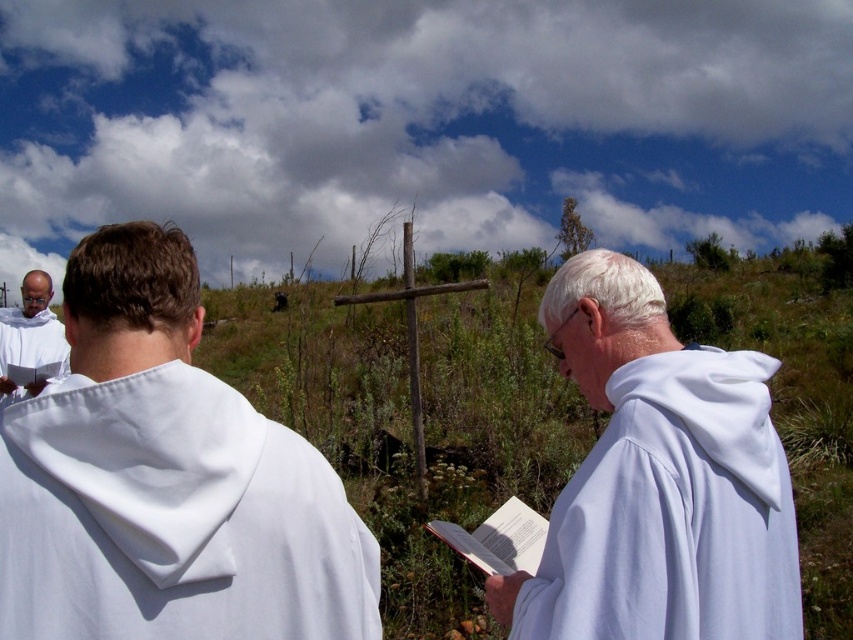
Question: Estimate the real-world distances between objects in this image. Which object is closer to the white cloth book at center?

Choices:
 (A) white clothed figure at left
 (B) white cloth at left

Answer: (B)

Question: Which object is closer to the camera taking this photo?

Choices:
 (A) white cloth at left
 (B) white cloth book at center

Answer: (A)

Question: Does white cloth at left appear under white clothed figure at left?

Choices:
 (A) yes
 (B) no

Answer: (A)

Question: Can you confirm if white cloth at left is positioned below white cloth book at center?

Choices:
 (A) no
 (B) yes

Answer: (A)

Question: Which object is closer to the camera taking this photo?

Choices:
 (A) white cloth at left
 (B) white cloth book at center
 (C) white clothed figure at left

Answer: (A)

Question: Where is white cloth book at center located in relation to white clothed figure at left in the image?

Choices:
 (A) above
 (B) below

Answer: (B)